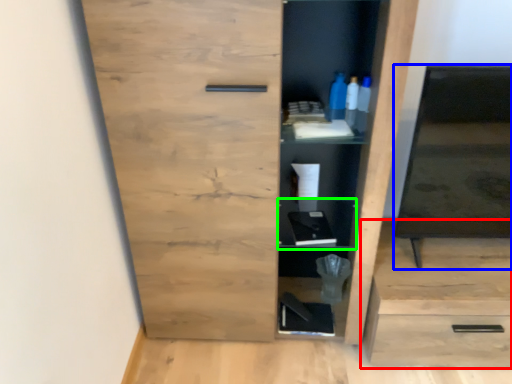
Question: Estimate the real-world distances between objects in this image. Which object is farther from cabinetry (highlighted by a red box), medicine cabinet (highlighted by a blue box) or cabinet (highlighted by a green box)?

Choices:
 (A) medicine cabinet
 (B) cabinet

Answer: (B)